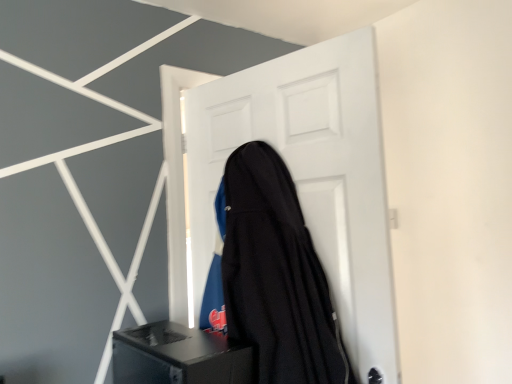
Question: Can you see black matte speaker at lower center touching black fabric guitar case at center?

Choices:
 (A) yes
 (B) no

Answer: (B)

Question: Considering the relative sizes of black matte speaker at lower center and black fabric guitar case at center in the image provided, is black matte speaker at lower center wider than black fabric guitar case at center?

Choices:
 (A) yes
 (B) no

Answer: (A)

Question: From a real-world perspective, is black matte speaker at lower center beneath black fabric guitar case at center?

Choices:
 (A) yes
 (B) no

Answer: (A)

Question: Is black matte speaker at lower center positioned behind black fabric guitar case at center?

Choices:
 (A) yes
 (B) no

Answer: (B)

Question: Are black matte speaker at lower center and black fabric guitar case at center located far from each other?

Choices:
 (A) no
 (B) yes

Answer: (A)

Question: Considering the relative sizes of black matte speaker at lower center and black fabric guitar case at center in the image provided, is black matte speaker at lower center thinner than black fabric guitar case at center?

Choices:
 (A) yes
 (B) no

Answer: (B)

Question: Is white matte door at center oriented towards black fabric guitar case at center?

Choices:
 (A) no
 (B) yes

Answer: (B)

Question: Is black fabric guitar case at center surrounded by white matte door at center?

Choices:
 (A) no
 (B) yes

Answer: (A)

Question: From a real-world perspective, is white matte door at center on black fabric guitar case at center?

Choices:
 (A) yes
 (B) no

Answer: (A)

Question: Does white matte door at center have a greater height compared to black fabric guitar case at center?

Choices:
 (A) yes
 (B) no

Answer: (A)

Question: Is black fabric guitar case at center at the back of white matte door at center?

Choices:
 (A) no
 (B) yes

Answer: (B)

Question: From a real-world perspective, is white matte door at center positioned under black fabric guitar case at center based on gravity?

Choices:
 (A) yes
 (B) no

Answer: (B)

Question: Does black fabric guitar case at center turn towards white matte door at center?

Choices:
 (A) yes
 (B) no

Answer: (A)